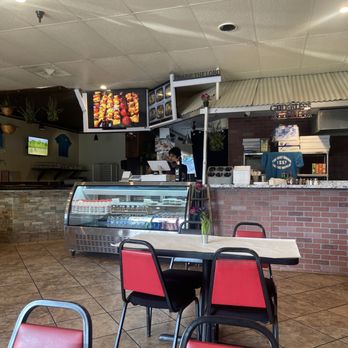
At what (x,y) coordinates should I click in order to perform the action: click on screen for cashier box. Please return your answer as a coordinate pair (x, y). Looking at the image, I should click on (161, 164).